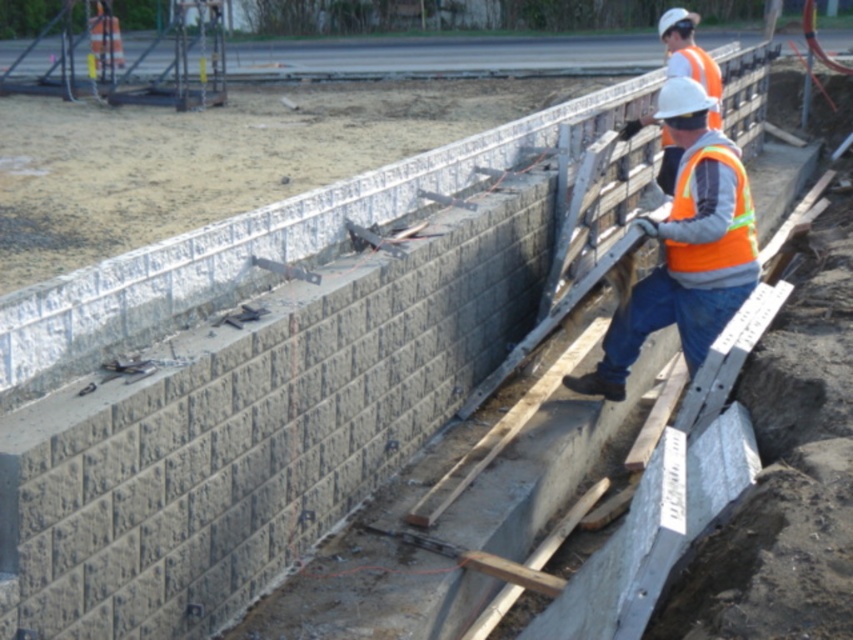
You are a safety inspector at the construction site. You notice a potential hazard at the point marked as point [730,253]. Considering the distance from the camera, is this point within the safe inspection range of your 20 feet safety radius?

The point [730,253] is 21.08 feet away from the camera, which exceeds the 20 feet safety radius. Therefore, the hazard is outside the safe inspection range.

You are a safety inspector at the construction site. You need to ensure that the orange reflective vest at upper right and orange reflective safety vest at center are within a 5 inch safety distance. Can you confirm if they are within the required distance?

The distance between the orange reflective vest at upper right and orange reflective safety vest at center is 5.23 inches, which exceeds the required 5 inch safety distance. Therefore, they are not within the required distance.